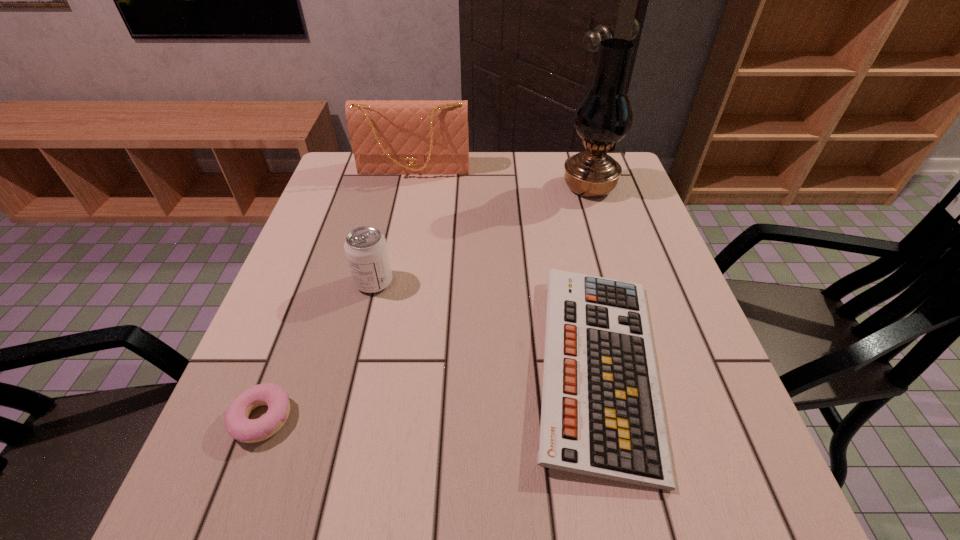
Where is `empty space between the doughnut and the handbag`? empty space between the doughnut and the handbag is located at coordinates (338, 294).

I want to click on free space between the soda can and the doughnut, so click(318, 350).

At what (x,y) coordinates should I click in order to perform the action: click on unoccupied area between the oil lamp and the soda can. Please return your answer as a coordinate pair (x, y). Looking at the image, I should click on (482, 234).

Locate an element on the screen. This screenshot has width=960, height=540. free point between the doughnut and the oil lamp is located at coordinates (425, 303).

Find the location of a particular element. This screenshot has height=540, width=960. vacant region between the computer keyboard and the soda can is located at coordinates (486, 324).

Identify which object is the fourth nearest to the doughnut. Please provide its 2D coordinates. Your answer should be formatted as a tuple, i.e. [(x, y)], where the tuple contains the x and y coordinates of a point satisfying the conditions above.

[(604, 116)]

This screenshot has height=540, width=960. In order to click on object that is the third closest to the oil lamp in this screenshot , I will do `click(366, 249)`.

At what (x,y) coordinates should I click in order to perform the action: click on free space that satisfies the following two spatial constraints: 1. on the front-facing side of the second tallest object; 2. on the left side of the oil lamp. Please return your answer as a coordinate pair (x, y). The image size is (960, 540). Looking at the image, I should click on (411, 187).

Where is `free spot that satisfies the following two spatial constraints: 1. on the back side of the oil lamp; 2. on the left side of the computer keyboard`? Image resolution: width=960 pixels, height=540 pixels. free spot that satisfies the following two spatial constraints: 1. on the back side of the oil lamp; 2. on the left side of the computer keyboard is located at coordinates (559, 187).

Where is `vacant area in the image that satisfies the following two spatial constraints: 1. on the front-facing side of the computer keyboard; 2. on the right side of the handbag`? Image resolution: width=960 pixels, height=540 pixels. vacant area in the image that satisfies the following two spatial constraints: 1. on the front-facing side of the computer keyboard; 2. on the right side of the handbag is located at coordinates (375, 366).